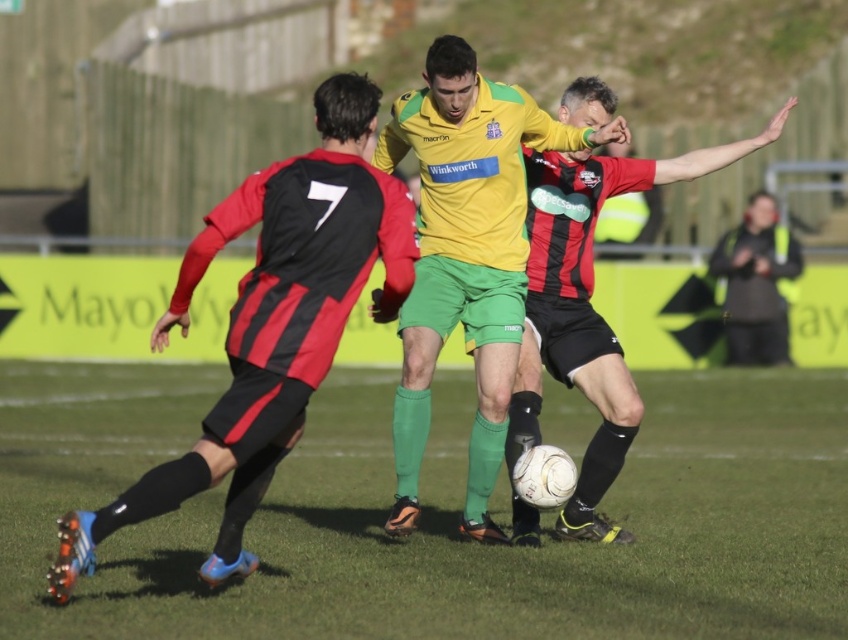
Can you confirm if matte black jersey at left is thinner than yellow jersey at center?

In fact, matte black jersey at left might be wider than yellow jersey at center.

Between matte black jersey at left and yellow jersey at center, which one appears on the left side from the viewer's perspective?

matte black jersey at left is more to the left.

Measure the distance between matte black jersey at left and camera.

A distance of 6.95 meters exists between matte black jersey at left and camera.

The width and height of the screenshot is (848, 640). I want to click on matte black jersey at left, so click(271, 323).

Who is positioned more to the left, green grass at center or yellow jersey at center?

Positioned to the left is yellow jersey at center.

Who is lower down, green grass at center or yellow jersey at center?

Positioned lower is green grass at center.

Who is more forward, (65, 620) or (517, 129)?

Positioned in front is point (65, 620).

Identify the location of green grass at center. The width and height of the screenshot is (848, 640). (432, 515).

Is yellow jersey at center above matte black shorts at center?

No, yellow jersey at center is not above matte black shorts at center.

Who is more forward, (467, 488) or (576, 525)?

Positioned in front is point (467, 488).

Locate an element on the screen. This screenshot has width=848, height=640. yellow jersey at center is located at coordinates (466, 256).